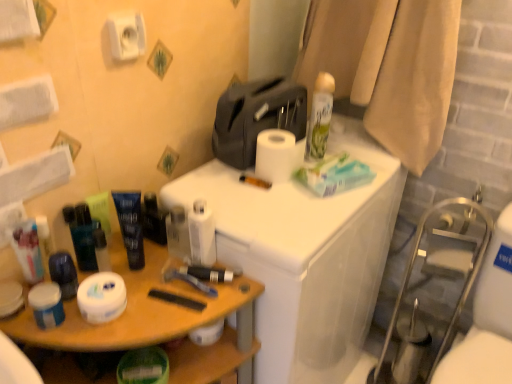
Find the location of a particular element. free space in front of white glossy toilet paper at center, arranged as the 3th toilet paper when viewed from the left is located at coordinates (174, 311).